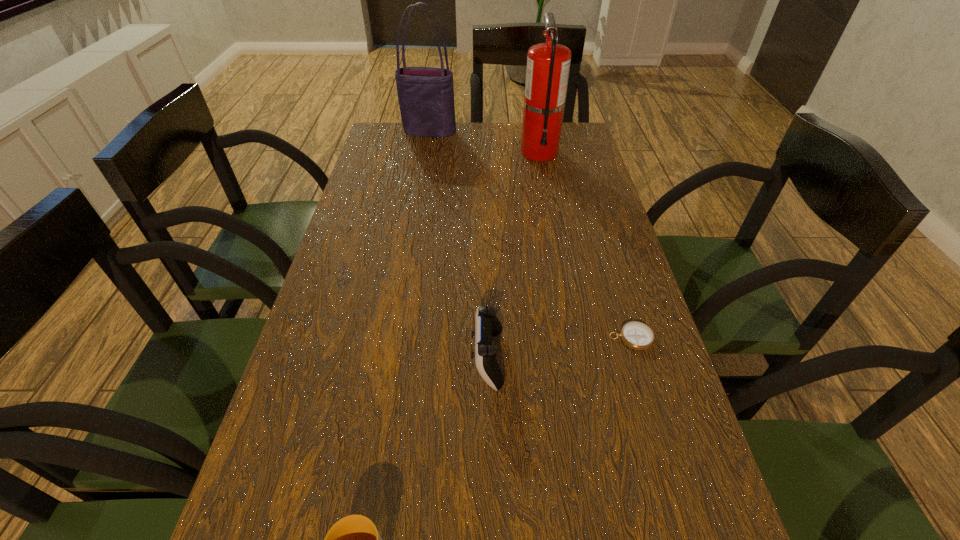
At what (x,y) coordinates should I click in order to perform the action: click on vacant space located on the front-facing side of the third object from left to right. Please return your answer as a coordinate pair (x, y). Image resolution: width=960 pixels, height=540 pixels. Looking at the image, I should click on (418, 359).

Locate an element on the screen. This screenshot has width=960, height=540. blank area located 0.160m on the back of the shortest object is located at coordinates (612, 274).

In order to click on tote bag at the far edge in this screenshot , I will do `click(426, 94)`.

Find the location of a particular element. fire extinguisher that is at the far edge is located at coordinates (548, 64).

Where is `object that is at the left edge`? The width and height of the screenshot is (960, 540). object that is at the left edge is located at coordinates (426, 94).

The image size is (960, 540). I want to click on fire extinguisher that is at the right edge, so click(548, 64).

I want to click on compass that is at the right edge, so click(x=636, y=335).

Find the location of `object that is positioned at the far left corner`. object that is positioned at the far left corner is located at coordinates (426, 94).

Where is `object present at the far right corner`? Image resolution: width=960 pixels, height=540 pixels. object present at the far right corner is located at coordinates (548, 64).

This screenshot has height=540, width=960. In the image, there is a desktop. In order to click on vacant space at the left edge in this screenshot , I will do `click(384, 275)`.